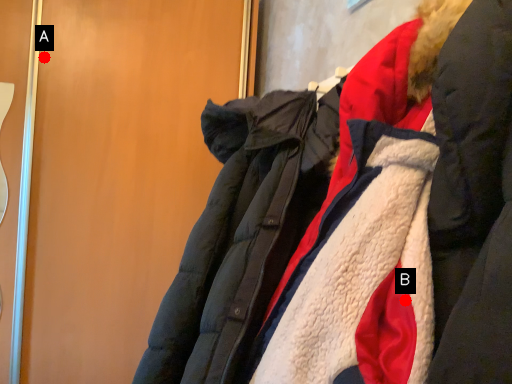
Question: Two points are circled on the image, labeled by A and B beside each circle. Which point appears closest to the camera in this image?

Choices:
 (A) A is closer
 (B) B is closer

Answer: (B)